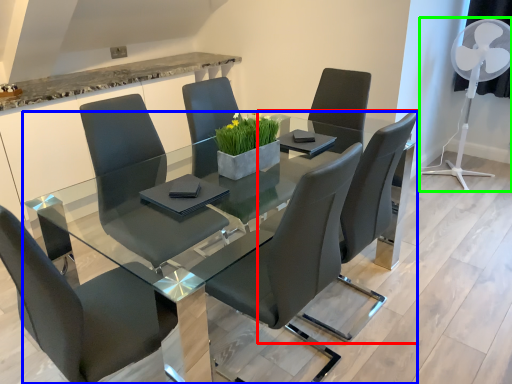
Question: Estimate the real-world distances between objects in this image. Which object is closer to chair (highlighted by a red box), table (highlighted by a blue box) or mechanical fan (highlighted by a green box)?

Choices:
 (A) table
 (B) mechanical fan

Answer: (A)